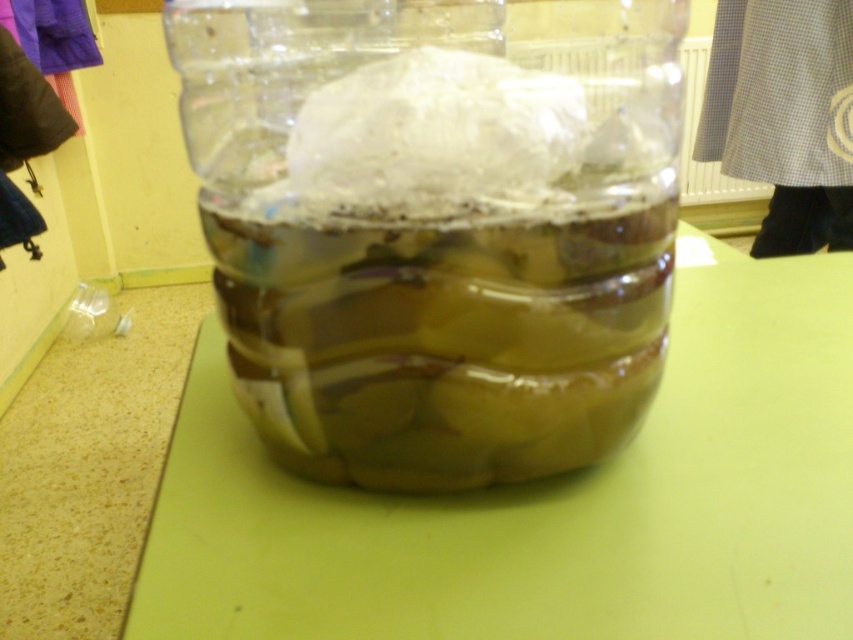
Does transparent plastic jar at center appear on the left side of green matte table at center?

Yes, transparent plastic jar at center is to the left of green matte table at center.

Does point (589, 401) come in front of point (262, 556)?

That is False.

Where is `transparent plastic jar at center`? The height and width of the screenshot is (640, 853). transparent plastic jar at center is located at coordinates (434, 228).